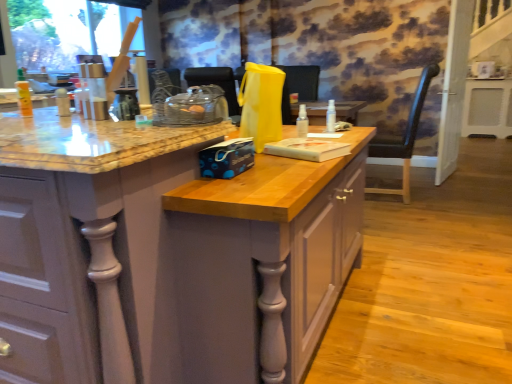
Question: Is black leather chair at right taller or shorter than matte wood cabinet at center?

Choices:
 (A) short
 (B) tall

Answer: (B)

Question: Which is correct: black leather chair at right is inside matte wood cabinet at center, or outside of it?

Choices:
 (A) outside
 (B) inside

Answer: (A)

Question: Based on their relative distances, which object is farther from the white glossy screen door at right?

Choices:
 (A) transparent plastic spray bottle at center, the 2th bottle when ordered from right to left
 (B) matte wood cabinet at center
 (C) transparent plastic spray bottle at center, the 1th bottle positioned from the right
 (D) white plastic heater at right
 (E) black leather chair at right

Answer: (B)

Question: Estimate the real-world distances between objects in this image. Which object is closer to the white glossy screen door at right?

Choices:
 (A) black leather chair at right
 (B) white plastic heater at right
 (C) transparent plastic spray bottle at center, which is the second bottle from back to front
 (D) transparent plastic spray bottle at center, arranged as the second bottle when viewed from the left
 (E) matte wood cabinet at center

Answer: (A)